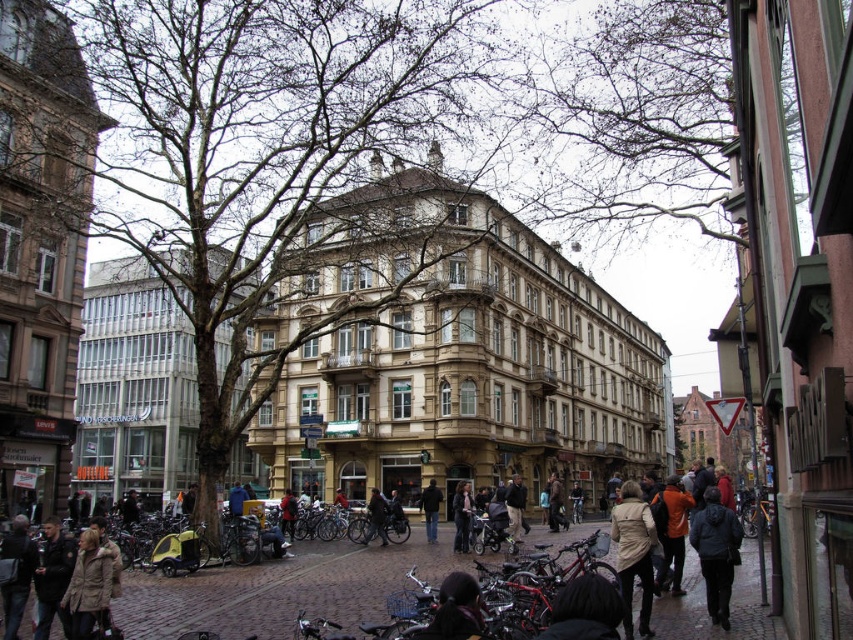
You are standing at the viewpoint of the image and want to reach the point marked as point (585, 580). If your walking speed is 1.5 meters per second, how many seconds will it take you to reach that point?

The distance between the viewer and point (585, 580) is 36.93 meters. At a walking speed of 1.5 meters per second, it would take approximately 24.62 seconds to reach the point.

You are a pedestrian standing on the cobblestone street and see both the black fabric jacket at lower center and the dark brown leather jacket at lower center. Which jacket is closer to you?

The black fabric jacket at lower center is closer to you as it is positioned in front of the dark brown leather jacket at lower center.

You are a pedestrian in the scene and want to find the orange fabric jacket at lower right quickly. Which direction should you move relative to the black fabric jacket at lower center?

To locate the orange fabric jacket at lower right, move to the right from the black fabric jacket at lower center since it is positioned to the left of the orange jacket.